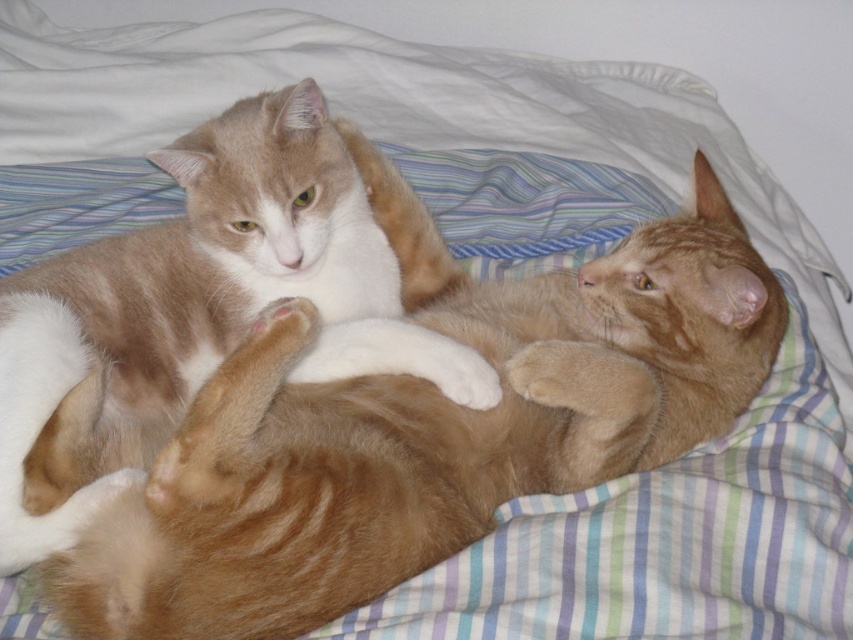
Between point (84, 403) and point (247, 291), which one is positioned behind?

The point (247, 291) is more distant.

Between point (711, 292) and point (314, 104), which one is positioned in front?

Point (711, 292)

This screenshot has width=853, height=640. In order to click on orange fur cat at upper left in this screenshot , I will do `click(424, 428)`.